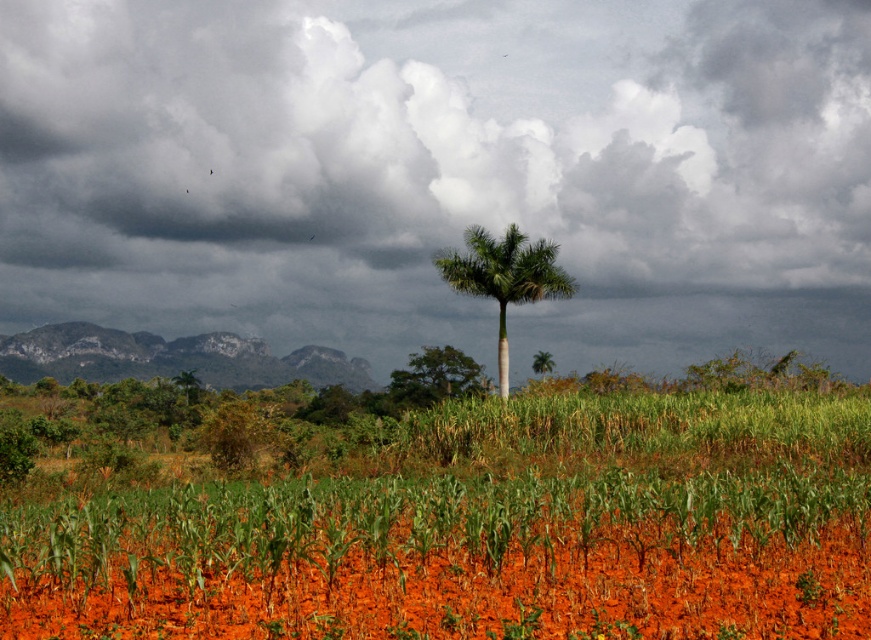
You are standing in the rural landscape and want to walk from the green leafy palm at center to the green leafy tree at center. Which direction should you move to reach it?

The green leafy palm at center is to the right of the green leafy tree at center, so you should move to the left to reach the green leafy tree at center.